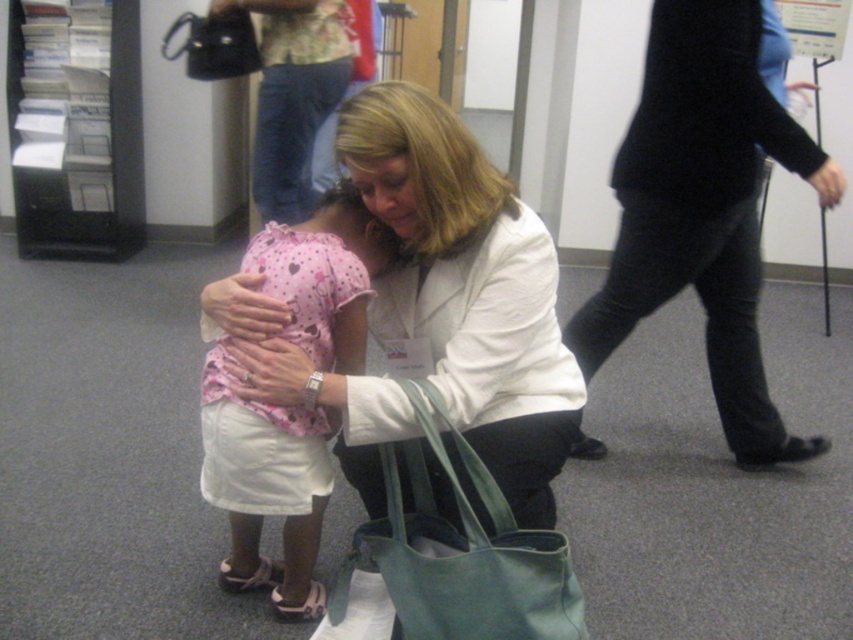
Between white matte coat at center and black leather handbag at upper left, which one has more height?

white matte coat at center

Which is below, white matte coat at center or black leather handbag at upper left?

white matte coat at center is below.

What are the coordinates of `white matte coat at center` in the screenshot? It's located at (466, 289).

Image resolution: width=853 pixels, height=640 pixels. Find the location of `white matte coat at center`. white matte coat at center is located at coordinates (466, 289).

Between point (747, 74) and point (254, 36), which one is positioned behind?

Point (254, 36)

Consider the image. Between black sweater at right and black leather handbag at upper left, which one appears on the left side from the viewer's perspective?

black leather handbag at upper left is more to the left.

Locate an element on the screen. black sweater at right is located at coordinates (704, 205).

Describe the element at coordinates (466, 289) in the screenshot. The image size is (853, 640). I see `white matte coat at center` at that location.

Image resolution: width=853 pixels, height=640 pixels. Identify the location of white matte coat at center. (466, 289).

Does point (549, 269) lie in front of point (335, 305)?

Yes.

Find the location of a particular element. The image size is (853, 640). white matte coat at center is located at coordinates (466, 289).